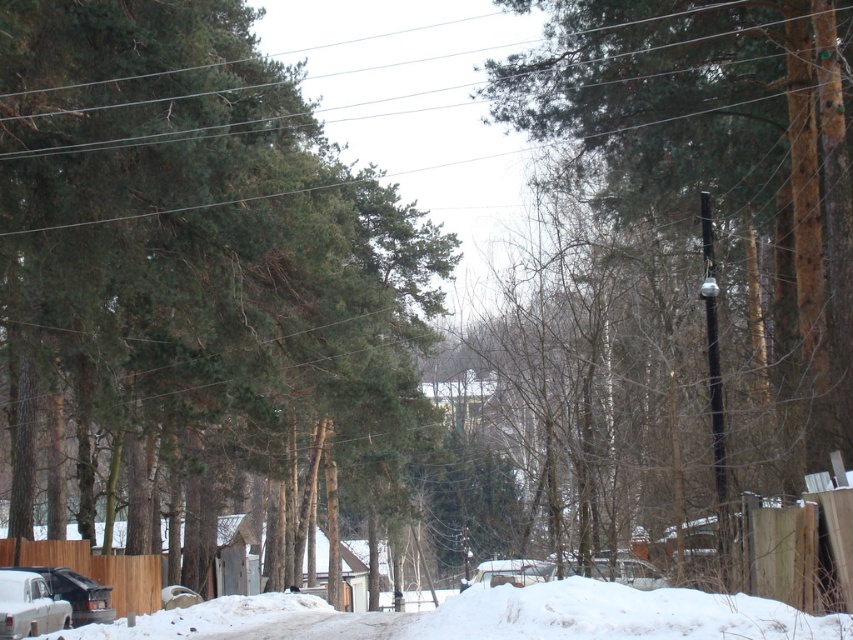
In the scene shown: You are standing at the point labeled as point (x=200, y=250) in the winter scene. Which object is directly beneath your feet?

The point (x=200, y=250) is located on the green matte tree at center, so the green matte tree at center is directly beneath your feet.

You are a delivery driver who needs to park your matte black car at lower left near the brown rough tree at center. Considering the height of the tree, will the car fit under it without any damage?

The brown rough tree at center is much taller than the matte black car at lower left, so the car should fit under it without any damage.